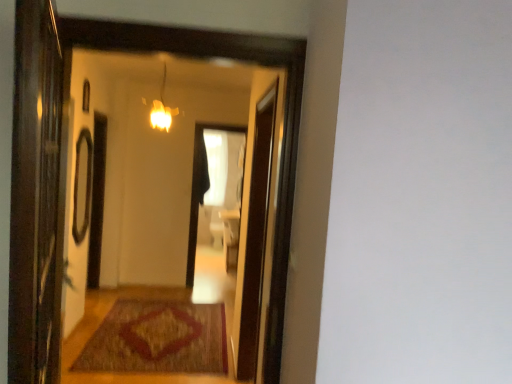
Question: Considering the relative positions of matte glass window at upper left and brown woven mat at center in the image provided, is matte glass window at upper left to the left of brown woven mat at center from the viewer's perspective?

Choices:
 (A) yes
 (B) no

Answer: (A)

Question: Is matte glass window at upper left shorter than brown woven mat at center?

Choices:
 (A) yes
 (B) no

Answer: (B)

Question: Does matte glass window at upper left have a lesser width compared to brown woven mat at center?

Choices:
 (A) no
 (B) yes

Answer: (B)

Question: Does matte glass window at upper left come in front of brown woven mat at center?

Choices:
 (A) yes
 (B) no

Answer: (B)

Question: Is matte glass window at upper left smaller than brown woven mat at center?

Choices:
 (A) yes
 (B) no

Answer: (A)

Question: Is brown woven mat at center in front of or behind transparent glass screen door at left, which appears as the 2th screen door when viewed from the right, in the image?

Choices:
 (A) front
 (B) behind

Answer: (B)

Question: Considering the positions of brown woven mat at center and transparent glass screen door at left, placed as the 2th screen door when sorted from back to front, in the image, is brown woven mat at center bigger or smaller than transparent glass screen door at left, placed as the 2th screen door when sorted from back to front,?

Choices:
 (A) small
 (B) big

Answer: (B)

Question: From the image's perspective, is brown woven mat at center positioned above or below transparent glass screen door at left, which appears as the 2th screen door when viewed from the right?

Choices:
 (A) above
 (B) below

Answer: (B)

Question: Considering the positions of brown woven mat at center and transparent glass screen door at left, which appears as the 2th screen door when viewed from the right, in the image, is brown woven mat at center wider or thinner than transparent glass screen door at left, which appears as the 2th screen door when viewed from the right,?

Choices:
 (A) thin
 (B) wide

Answer: (B)

Question: In terms of width, does brown woven mat at center look wider or thinner when compared to transparent glass screen door at center, which appears as the 2th screen door when viewed from the front?

Choices:
 (A) wide
 (B) thin

Answer: (A)

Question: Choose the correct answer: Is brown woven mat at center inside transparent glass screen door at center, marked as the 2th screen door in a left-to-right arrangement, or outside it?

Choices:
 (A) outside
 (B) inside

Answer: (A)

Question: Considering the positions of brown woven mat at center and transparent glass screen door at center, which appears as the 1th screen door when viewed from the back, in the image, is brown woven mat at center taller or shorter than transparent glass screen door at center, which appears as the 1th screen door when viewed from the back,?

Choices:
 (A) short
 (B) tall

Answer: (A)

Question: From a real-world perspective, is brown woven mat at center physically located above or below transparent glass screen door at center, marked as the 2th screen door in a left-to-right arrangement?

Choices:
 (A) below
 (B) above

Answer: (A)

Question: From their relative heights in the image, would you say matte glass light fixture at upper center is taller or shorter than transparent glass screen door at left, which appears as the 2th screen door when viewed from the right?

Choices:
 (A) short
 (B) tall

Answer: (A)

Question: Looking at their shapes, would you say matte glass light fixture at upper center is wider or thinner than transparent glass screen door at left, which appears as the 2th screen door when viewed from the right?

Choices:
 (A) thin
 (B) wide

Answer: (B)